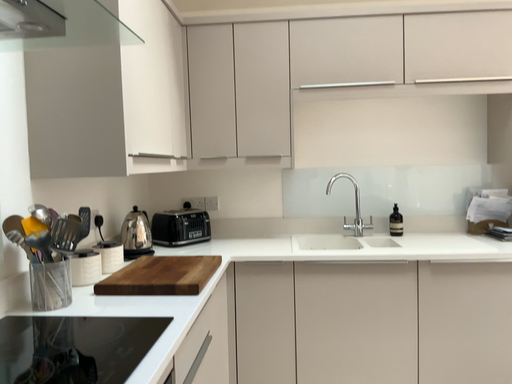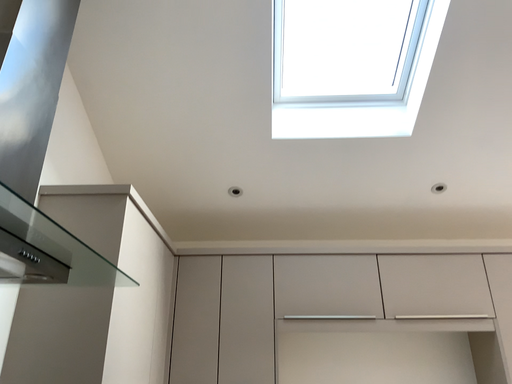
Question: How did the camera likely rotate when shooting the video?

Choices:
 (A) rotated downward
 (B) rotated upward

Answer: (B)